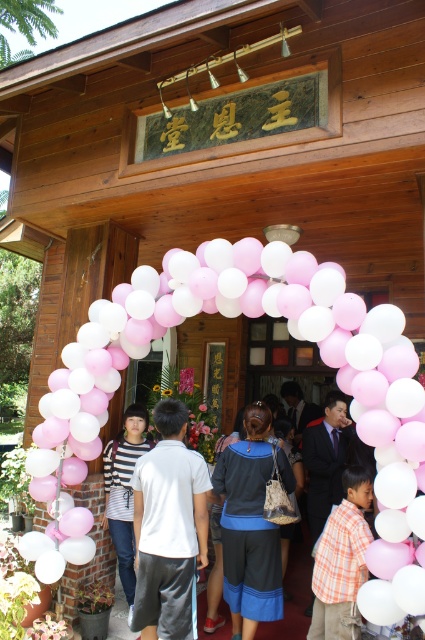
Who is positioned more to the right, pink matte balloons at center or dark gray fabric shorts at center?

Positioned to the right is dark gray fabric shorts at center.

Who is taller, pink matte balloons at center or dark gray fabric shorts at center?

Standing taller between the two is pink matte balloons at center.

Which is in front, point (416, 412) or point (235, 461)?

Positioned in front is point (416, 412).

Where is `pink matte balloons at center`? pink matte balloons at center is located at coordinates (300, 332).

Can you confirm if dark gray fabric shorts at center is positioned above striped fabric shirt at center?

Indeed, dark gray fabric shorts at center is positioned over striped fabric shirt at center.

Is point (231, 602) positioned behind point (127, 556)?

No, it is not.

Find the location of a particular element. Image resolution: width=425 pixels, height=640 pixels. dark gray fabric shorts at center is located at coordinates (249, 528).

In the scene shown: Who is lower down, pink matte balloons at center or striped fabric shirt at center?

Positioned lower is striped fabric shirt at center.

Is point (244, 256) less distant than point (110, 449)?

That is True.

Between point (127, 349) and point (113, 480), which one is positioned behind?

The point (113, 480) is behind.

Locate an element on the screen. This screenshot has width=425, height=640. pink matte balloons at center is located at coordinates (300, 332).